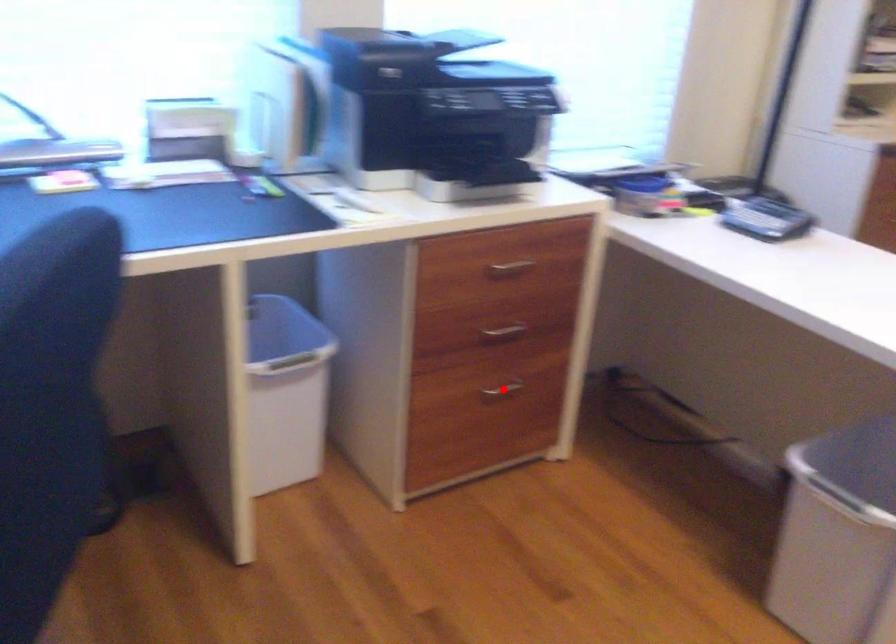
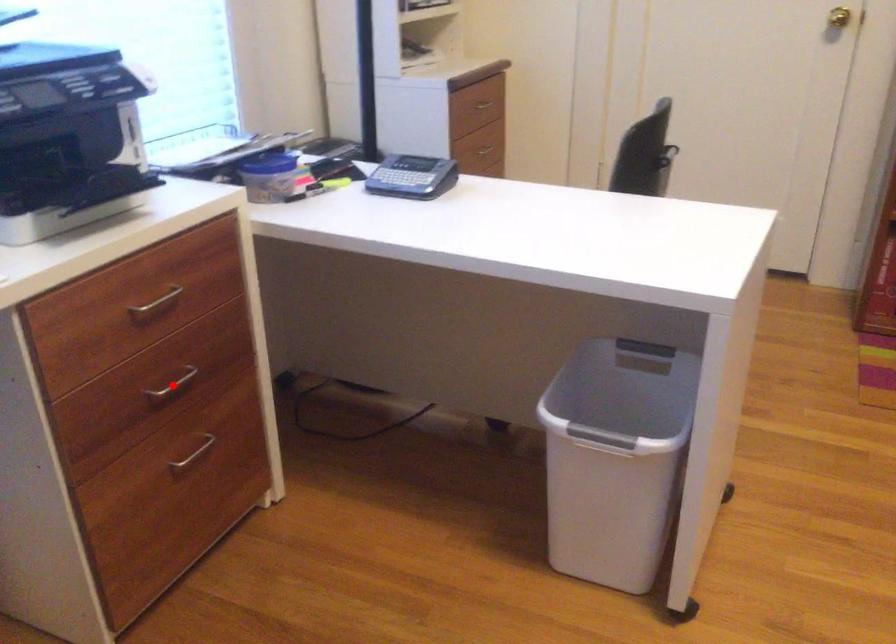
I am providing you with two images of the same scene from different viewpoints. A red point is marked on the first image and another point is marked on the second image. Do the highlighted points in image1 and image2 indicate the same real-world spot?

No